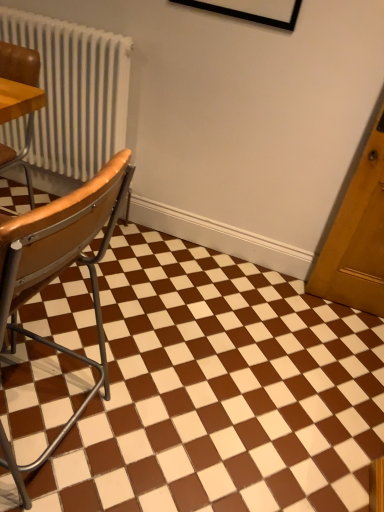
Question: Is leather seat at left, which is the first chair in top-to-bottom order, to the left or to the right of brown glossy tile at center in the image?

Choices:
 (A) right
 (B) left

Answer: (B)

Question: Considering the positions of leather seat at left, which appears as the 2th chair when ordered from the bottom, and brown glossy tile at center in the image, is leather seat at left, which appears as the 2th chair when ordered from the bottom, taller or shorter than brown glossy tile at center?

Choices:
 (A) tall
 (B) short

Answer: (A)

Question: Considering the real-world distances, which object is farthest from the brown glossy tile at center?

Choices:
 (A) wooden seat at left, positioned as the 1th chair in bottom-to-top order
 (B) leather seat at left, which appears as the 2th chair when ordered from the bottom

Answer: (B)

Question: Which is farther from the leather seat at left, which appears as the 2th chair when ordered from the bottom?

Choices:
 (A) wooden seat at left, marked as the 2th chair in a top-to-bottom arrangement
 (B) brown glossy tile at center

Answer: (B)